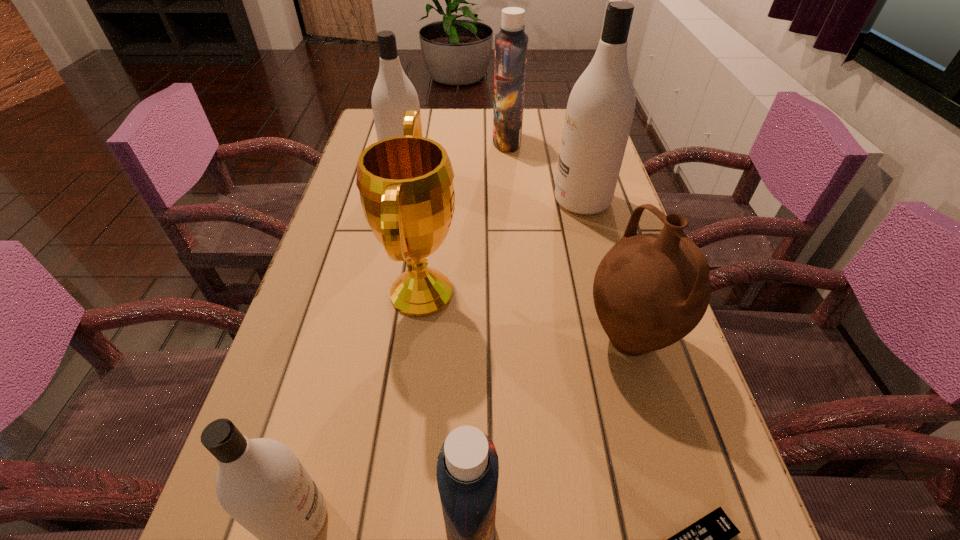
Identify which shampoo is the third closest to the nearest white shampoo. Please provide its 2D coordinates. Your answer should be formatted as a tuple, i.e. [(x, y)], where the tuple contains the x and y coordinates of a point satisfying the conditions above.

[(393, 93)]

Identify which white shampoo is located as the third nearest to the farthest object. Please provide its 2D coordinates. Your answer should be formatted as a tuple, i.e. [(x, y)], where the tuple contains the x and y coordinates of a point satisfying the conditions above.

[(260, 483)]

Where is `the closest white shampoo to the biggest white shampoo`? This screenshot has height=540, width=960. the closest white shampoo to the biggest white shampoo is located at coordinates point(393,93).